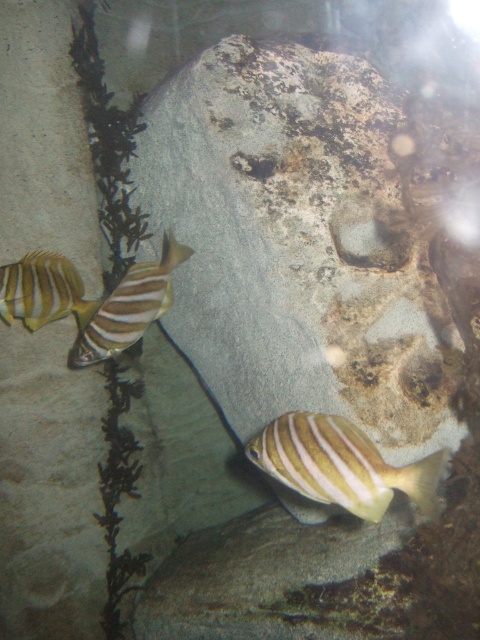
Question: Is yellow striped fish at left bigger than shiny yellow fish at left?

Choices:
 (A) yes
 (B) no

Answer: (A)

Question: Which point is farther to the camera?

Choices:
 (A) yellow striped fish at left
 (B) yellow striped fish at lower center
 (C) shiny yellow fish at left

Answer: (C)

Question: Among these objects, which one is farthest from the camera?

Choices:
 (A) yellow striped fish at lower center
 (B) yellow striped fish at left

Answer: (B)

Question: Is yellow striped fish at lower center to the left of shiny yellow fish at left from the viewer's perspective?

Choices:
 (A) yes
 (B) no

Answer: (B)

Question: Can you confirm if yellow striped fish at left is smaller than shiny yellow fish at left?

Choices:
 (A) no
 (B) yes

Answer: (A)

Question: Which of the following is the closest to the observer?

Choices:
 (A) shiny yellow fish at left
 (B) yellow striped fish at left
 (C) yellow striped fish at lower center

Answer: (C)